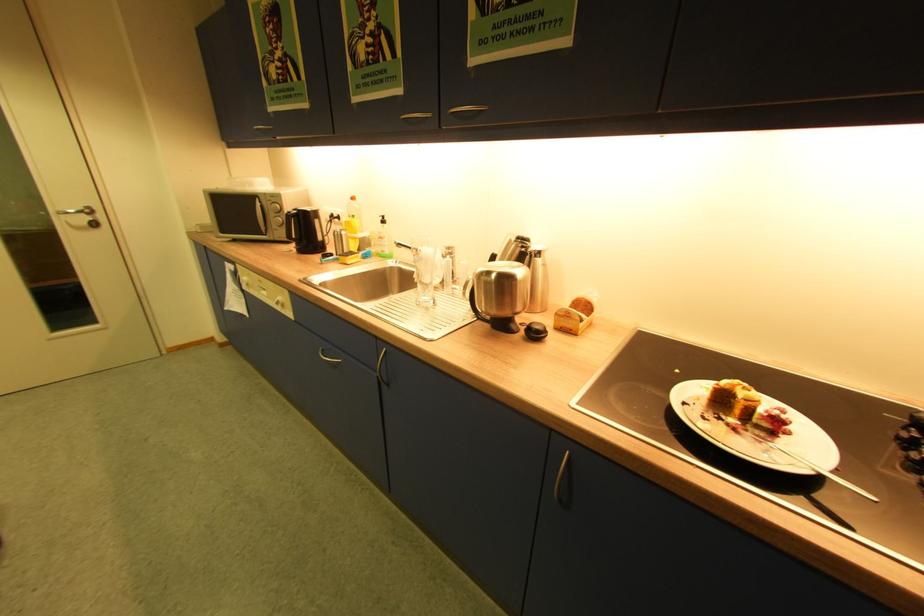
Find where to push the soap dispenser pump. Please return your answer as a coordinate pair (x, y).

(383, 225)